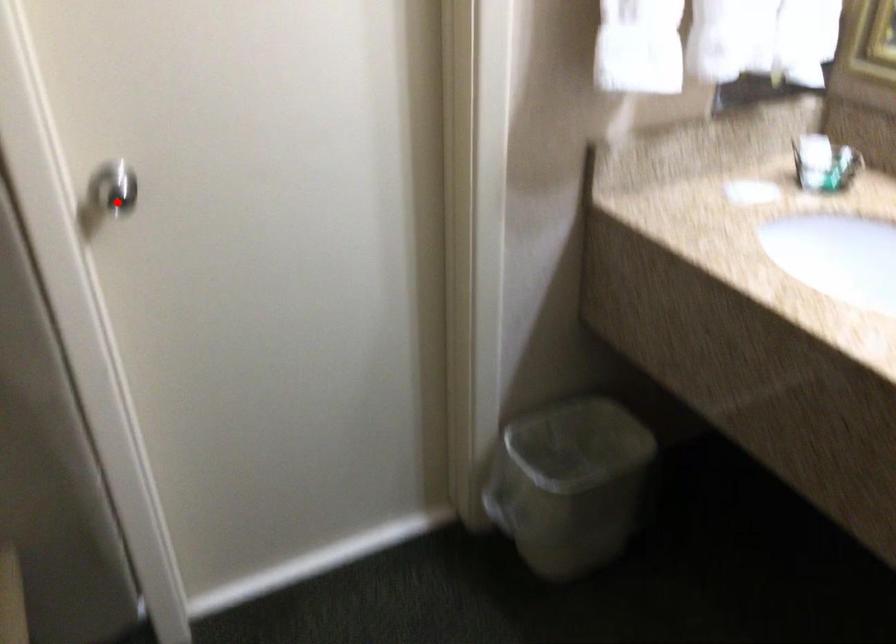
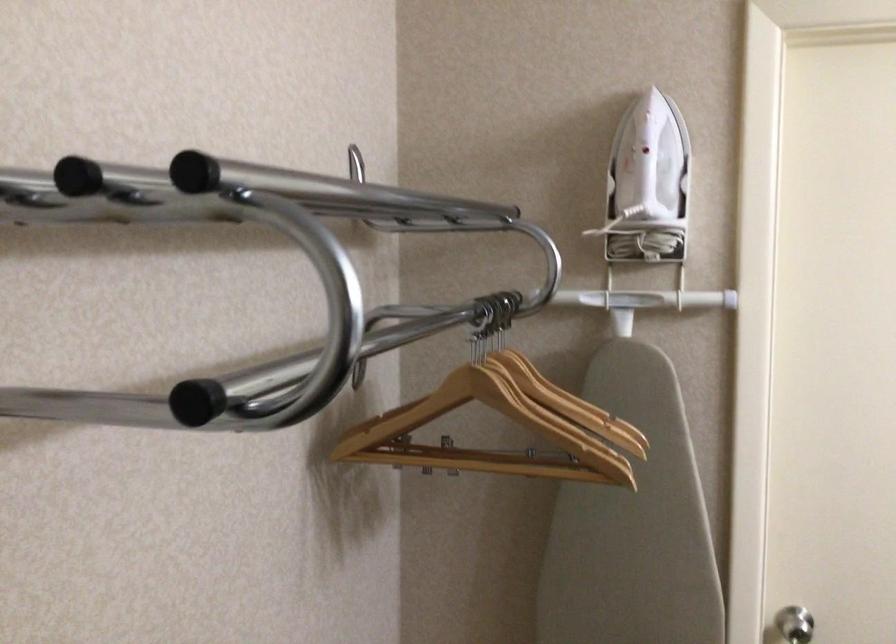
Question: I am providing you with two images of the same scene from different viewpoints. Image1 has a red point marked. In image2, the corresponding 3D location appears at what relative position? Reply with the corresponding letter.

Choices:
 (A) Closer
 (B) Farther

Answer: (B)